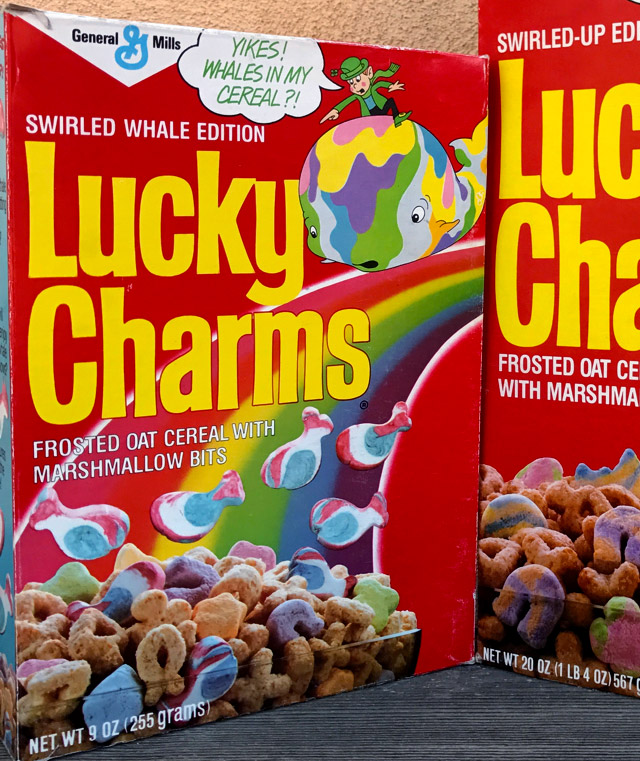
The height and width of the screenshot is (761, 640). Identify the location of table. tap(479, 701).